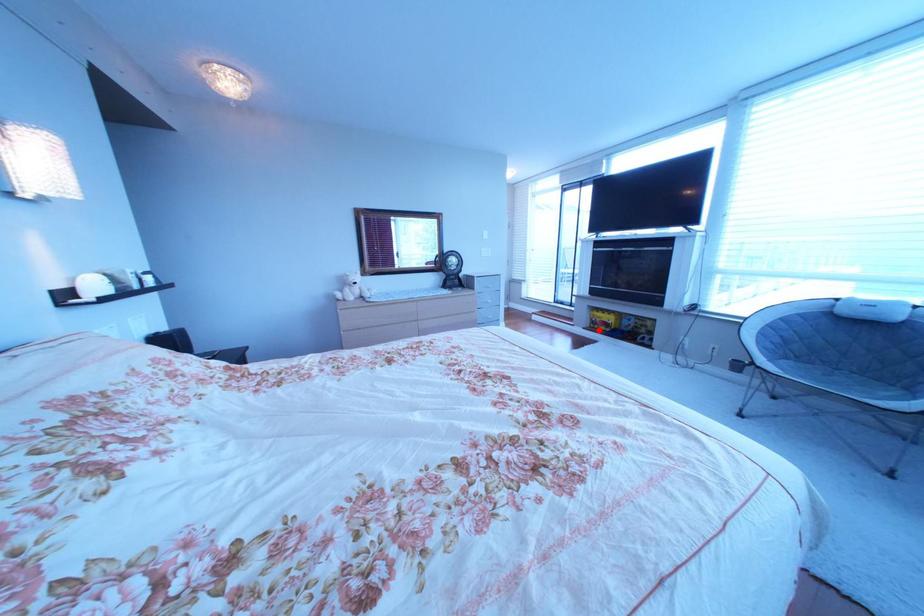
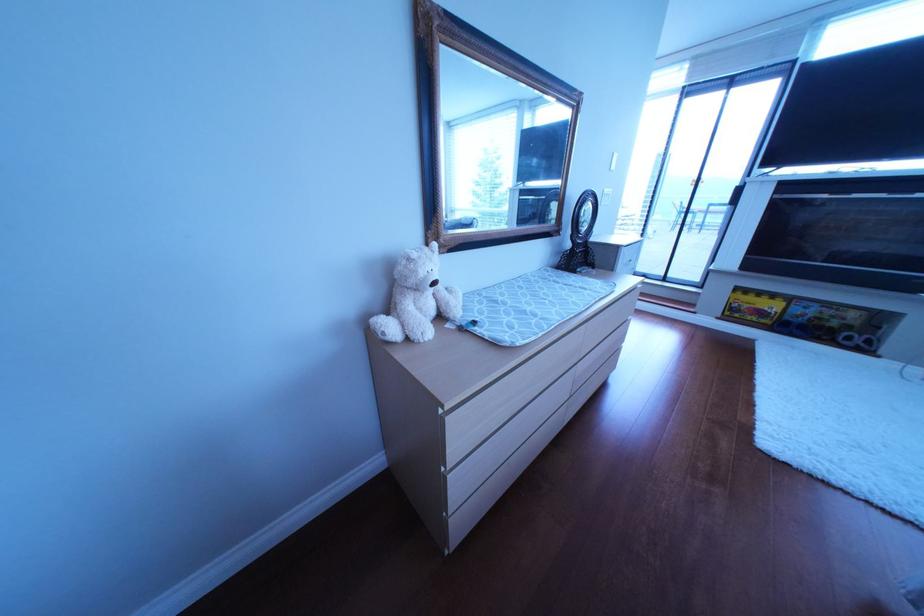
Locate, in the second image, the point that corresponds to the highlighted location in the first image.

(733, 320)